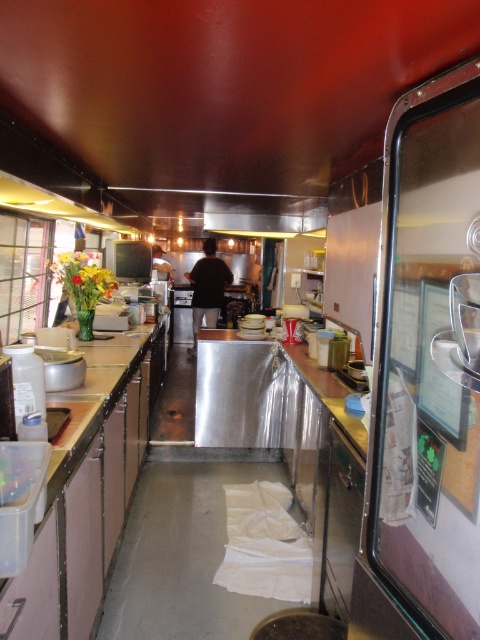
You are inside a food truck and need to reach the metallic stainless steel door at center to exit. However, there is a silver metallic counter at center in your way. Can you step over the counter to reach the door?

The metallic stainless steel door at center is taller than the silver metallic counter at center, so yes, you can step over the silver metallic counter at center to reach the metallic stainless steel door at center since it is taller than the counter.

You are a food truck worker who needs to access the storage area behind the metallic stainless steel door at center. To reach it, you must move past the silver metallic counter at center. From your current position at the left side of the counter, which direction should you move to first approach the door?

Since the metallic stainless steel door at center is positioned on the right side of the silver metallic counter at center, you should move to the right side of the silver metallic counter at center to approach the door.

You are a food truck worker who needs to reach the metallic stainless steel door at center to access the storage area. Considering your height is 5 feet 6 inches, can you comfortably reach the door without needing a stool?

The metallic stainless steel door at center is 3.97 feet away from the camera, which is within comfortable reach for someone of 5 feet 6 inches. Therefore, you can comfortably reach the door without needing a stool.